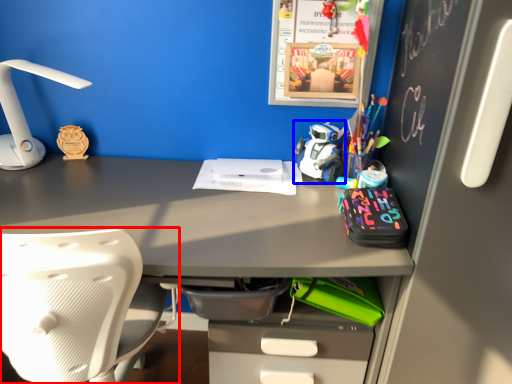
Question: Among these objects, which one is nearest to the camera, chair (highlighted by a red box) or toy (highlighted by a blue box)?

Choices:
 (A) chair
 (B) toy

Answer: (A)